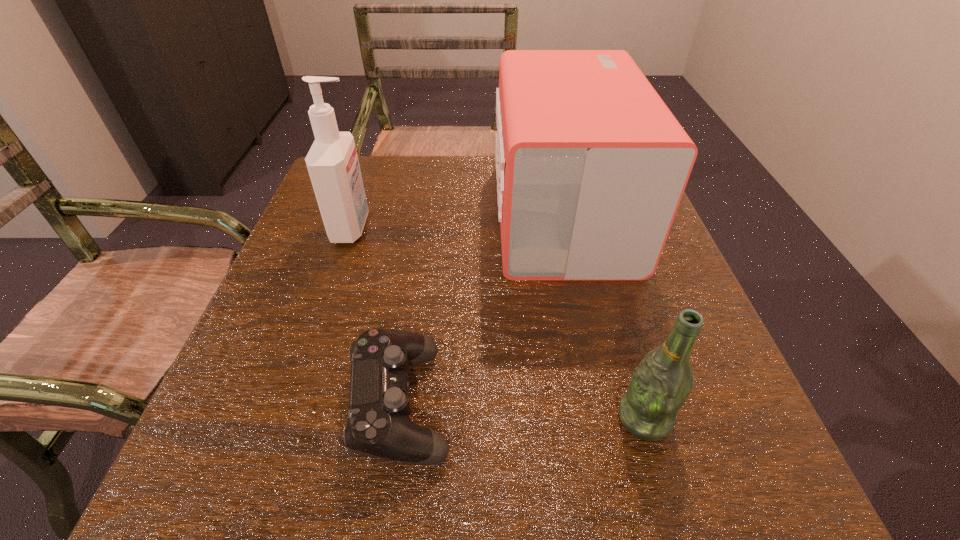
Locate an element on the screen. Image resolution: width=960 pixels, height=540 pixels. object located at the near right corner is located at coordinates (663, 380).

This screenshot has height=540, width=960. What are the coordinates of `vacant point at the far edge` in the screenshot? It's located at pyautogui.click(x=434, y=206).

This screenshot has width=960, height=540. What are the coordinates of `vacant space at the near edge of the desktop` in the screenshot? It's located at (582, 468).

This screenshot has height=540, width=960. In the image, there is a desktop. In order to click on vacant space at the left edge in this screenshot , I will do click(321, 344).

This screenshot has height=540, width=960. In order to click on vacant position at the right edge of the desktop in this screenshot , I will do `click(633, 317)`.

In the image, there is a desktop. Where is `free space at the near right corner`? This screenshot has width=960, height=540. free space at the near right corner is located at coordinates (654, 455).

Where is `free space between the leftmost object and the third tallest object`? free space between the leftmost object and the third tallest object is located at coordinates (498, 323).

This screenshot has width=960, height=540. I want to click on unoccupied position between the shortest object and the second shortest object, so click(x=522, y=411).

You are a GUI agent. You are given a task and a screenshot of the screen. Output one action in this format:
    pyautogui.click(x=<x>, y=<y>)
    Task: Click on the blank region between the box and the second shortest object
    Image resolution: width=960 pixels, height=540 pixels.
    Given the screenshot: What is the action you would take?
    pyautogui.click(x=603, y=317)

Find the location of a particular element. The image size is (960, 540). vacant space that's between the second object from left to right and the third tallest object is located at coordinates 522,411.